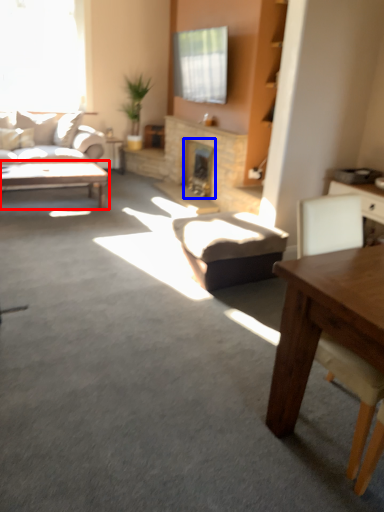
Question: Which object appears closest to the camera in this image, coffee table (highlighted by a red box) or fireplace (highlighted by a blue box)?

Choices:
 (A) coffee table
 (B) fireplace

Answer: (A)